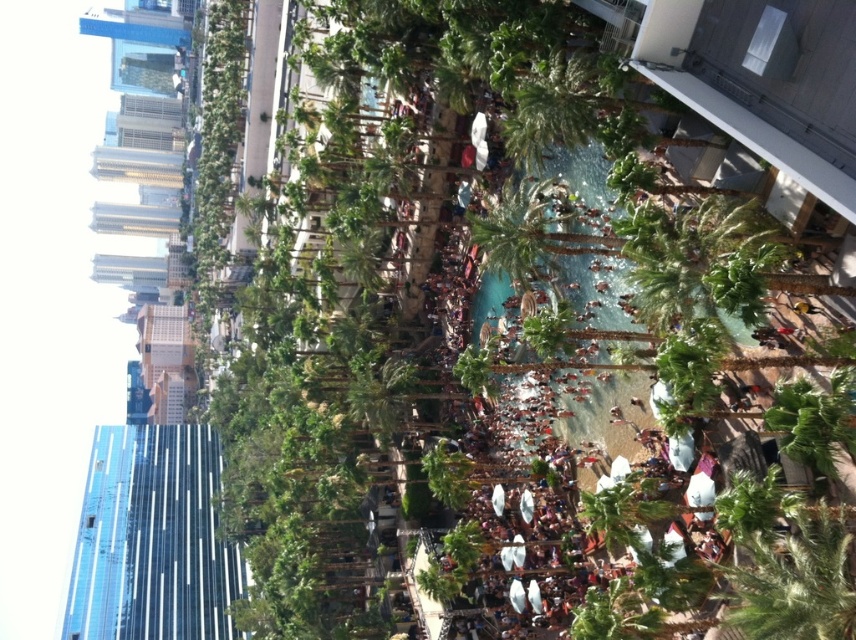
Question: Among these points, which one is farthest from the camera?

Choices:
 (A) (474, 240)
 (B) (86, 477)

Answer: (B)

Question: In this image, where is transparent glass building at left located relative to green leafy palm tree at center?

Choices:
 (A) below
 (B) above

Answer: (A)

Question: Which of the following is the closest to the observer?

Choices:
 (A) transparent glass building at left
 (B) green leafy palm tree at center

Answer: (B)

Question: Does transparent glass building at left lie behind green leafy palm tree at center?

Choices:
 (A) no
 (B) yes

Answer: (B)

Question: Can you confirm if transparent glass building at left is thinner than green leafy palm tree at center?

Choices:
 (A) no
 (B) yes

Answer: (A)

Question: Which point is farther from the camera taking this photo?

Choices:
 (A) (536, 234)
 (B) (128, 480)

Answer: (B)